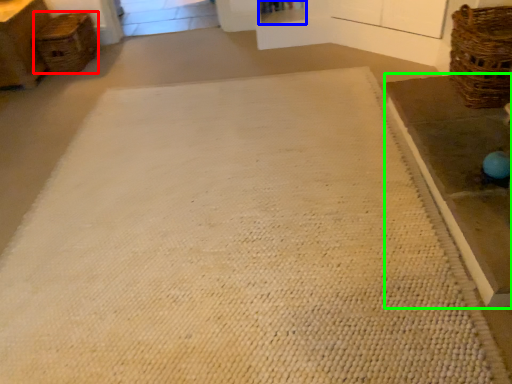
Question: Which is nearer to the basket (highlighted by a red box)? shelf (highlighted by a blue box) or table (highlighted by a green box).

Choices:
 (A) shelf
 (B) table

Answer: (A)